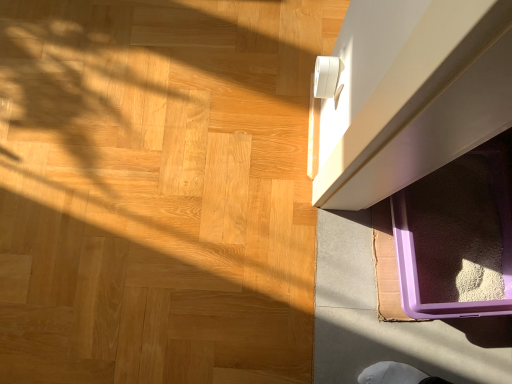
Where is `blank space above purple plastic tray at lower right (from a real-world perspective)`? This screenshot has height=384, width=512. blank space above purple plastic tray at lower right (from a real-world perspective) is located at coordinates (204, 187).